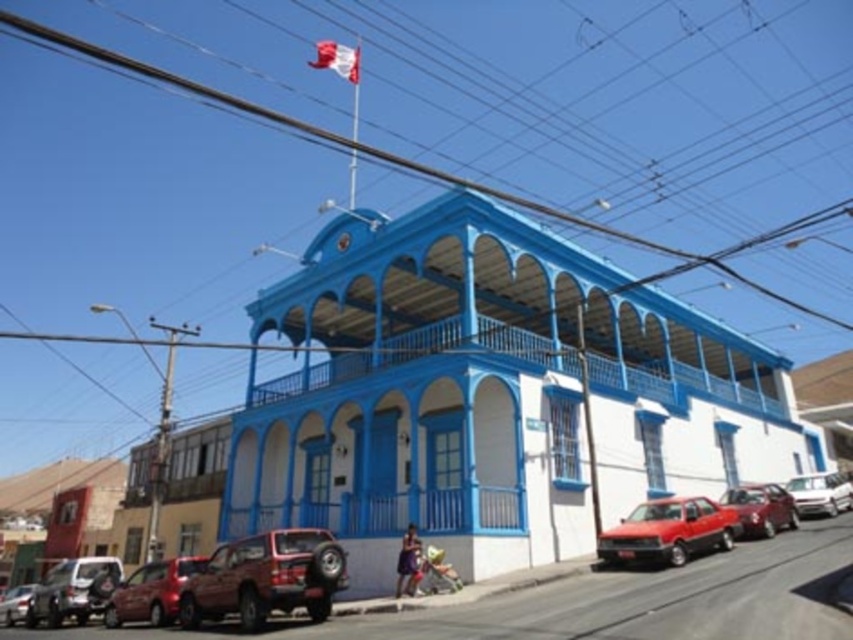
You are a pedestrian standing on the sidewalk in front of the building. You need to cross the street to reach the park on the other side. There are two matte red suv at lower left and matte black suv at lower left parked at the curb. Which vehicle should you avoid stepping over when crossing?

You should avoid stepping over the matte red suv at lower left because it is positioned over the matte black suv at lower left, meaning it is closer to the sidewalk and in your path.

You are a delivery driver who needs to park your vehicle between the matte red suv at lower left and the matte black suv at lower left. The length of your delivery van is 6 meters. Is there enough space between them to park your van?

The distance between the matte red suv at lower left and the matte black suv at lower left is 20.09 meters. Since your delivery van is only 6 meters long, there is sufficient space to park between them.